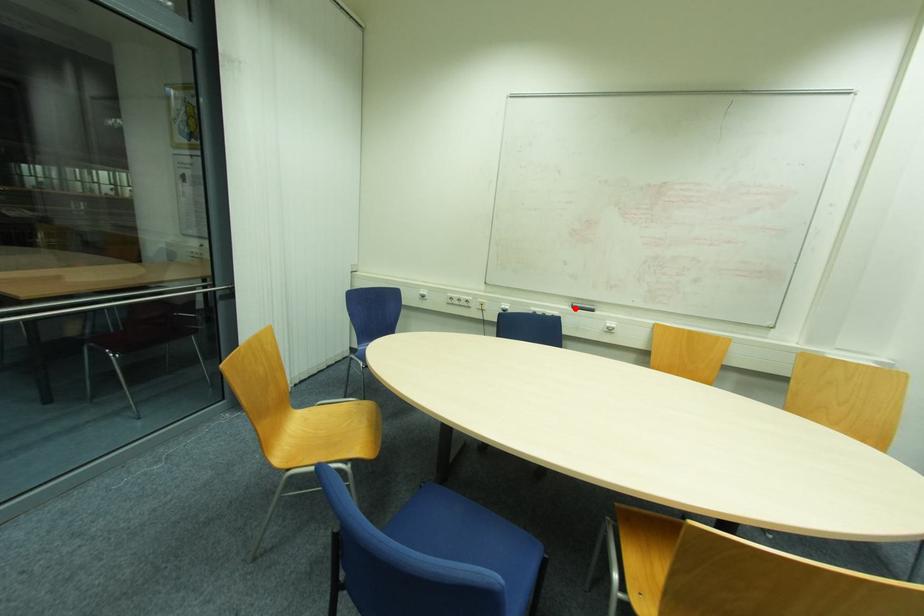
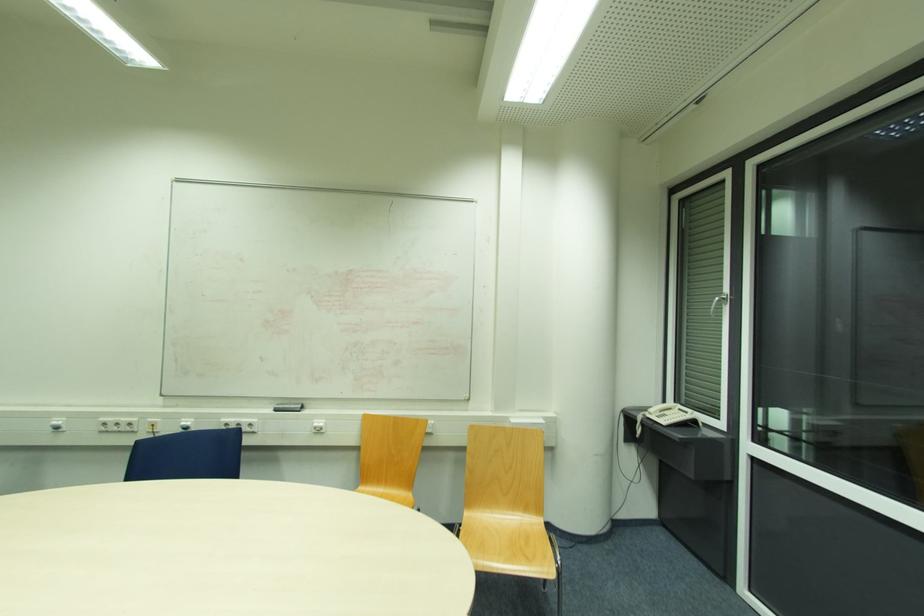
In the second image, find the point that corresponds to the highlighted location in the first image.

(276, 411)